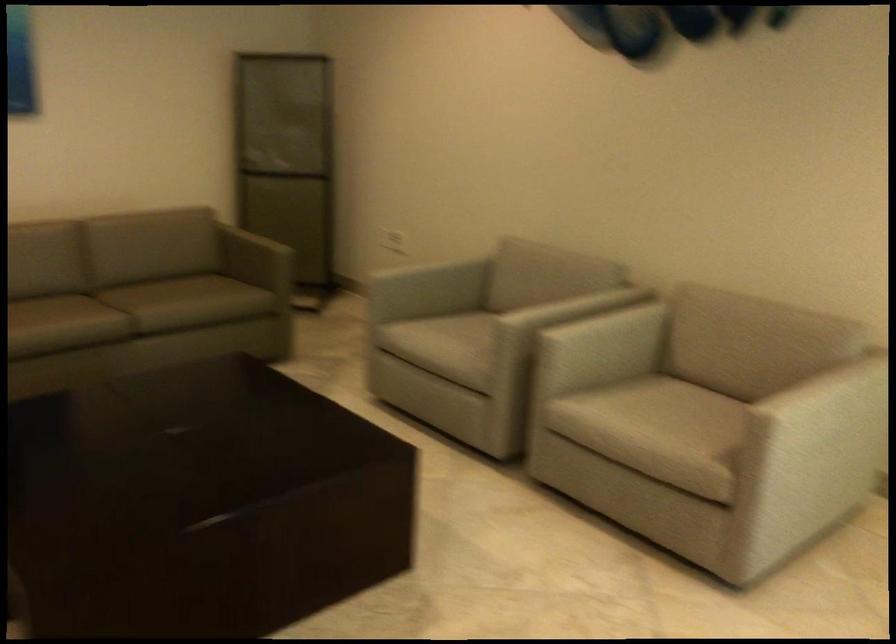
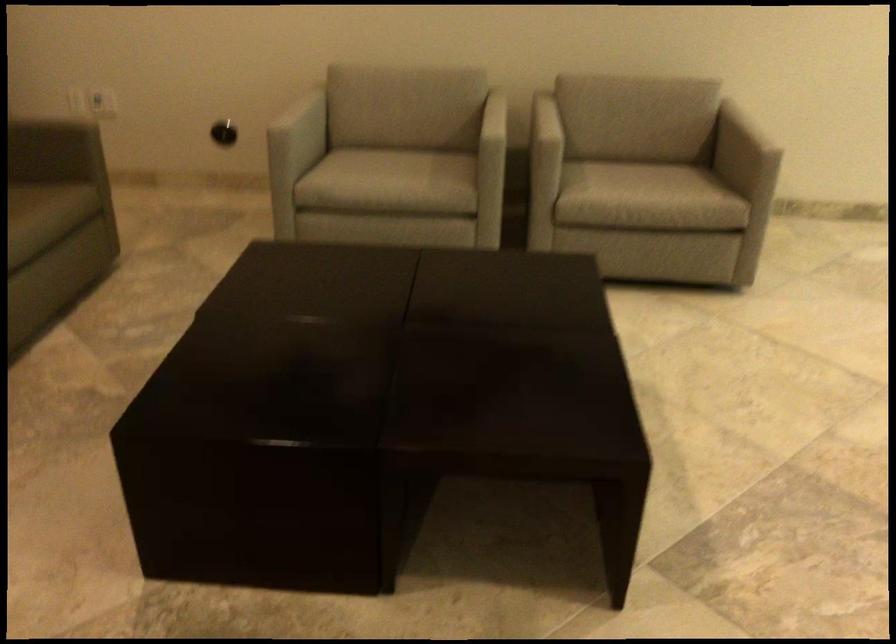
Where in the second image is the point corresponding to (x=203, y=306) from the first image?

(36, 219)